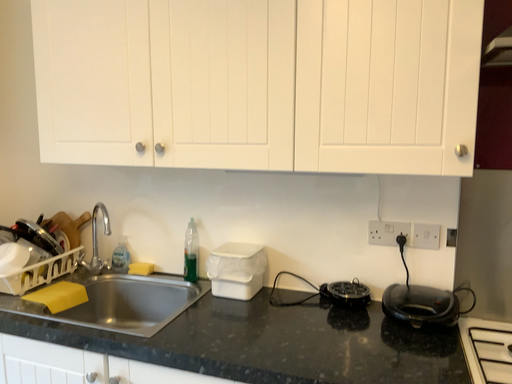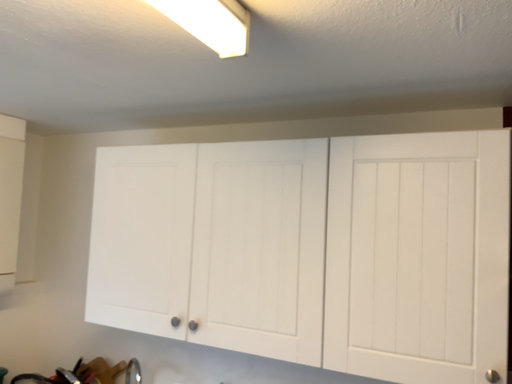
Question: How did the camera likely rotate when shooting the video?

Choices:
 (A) rotated left
 (B) rotated right

Answer: (A)